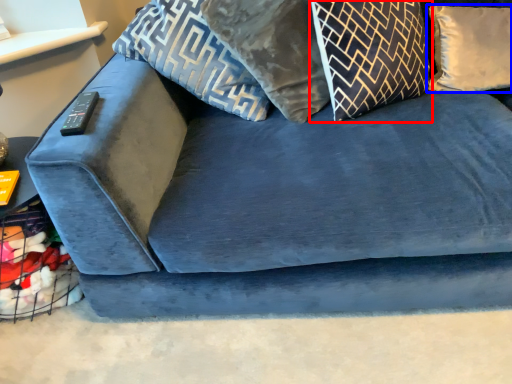
Question: Which of the following is the closest to the observer, pillow (highlighted by a red box) or pillow (highlighted by a blue box)?

Choices:
 (A) pillow
 (B) pillow

Answer: (A)